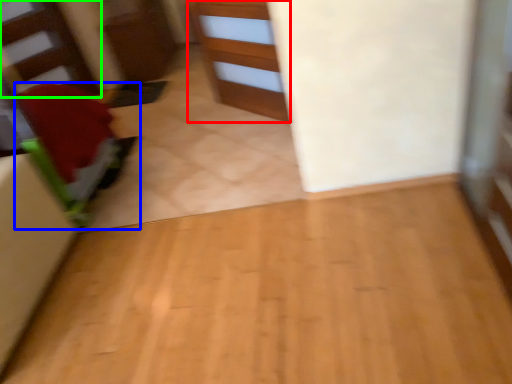
Question: Which is nearer to the cabinetry (highlighted by a red box)? furniture (highlighted by a blue box) or stairwell (highlighted by a green box).

Choices:
 (A) furniture
 (B) stairwell

Answer: (A)